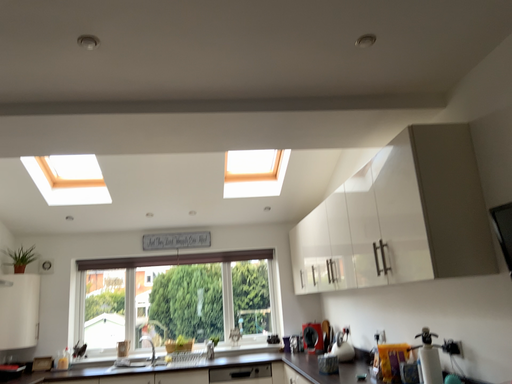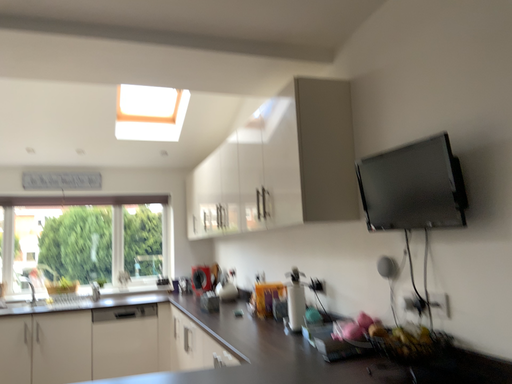
Question: Which way did the camera rotate in the video?

Choices:
 (A) rotated left
 (B) rotated right

Answer: (B)